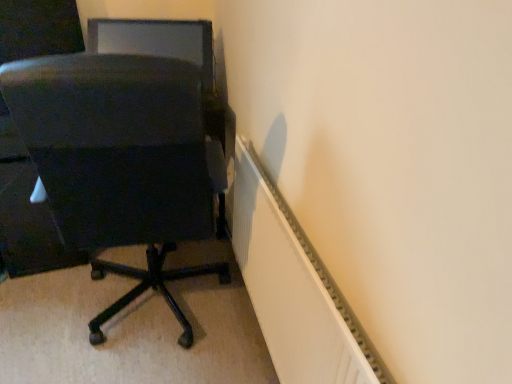
Locate an element on the screen. vacant location below matte black chair at left (from a real-world perspective) is located at coordinates (159, 303).